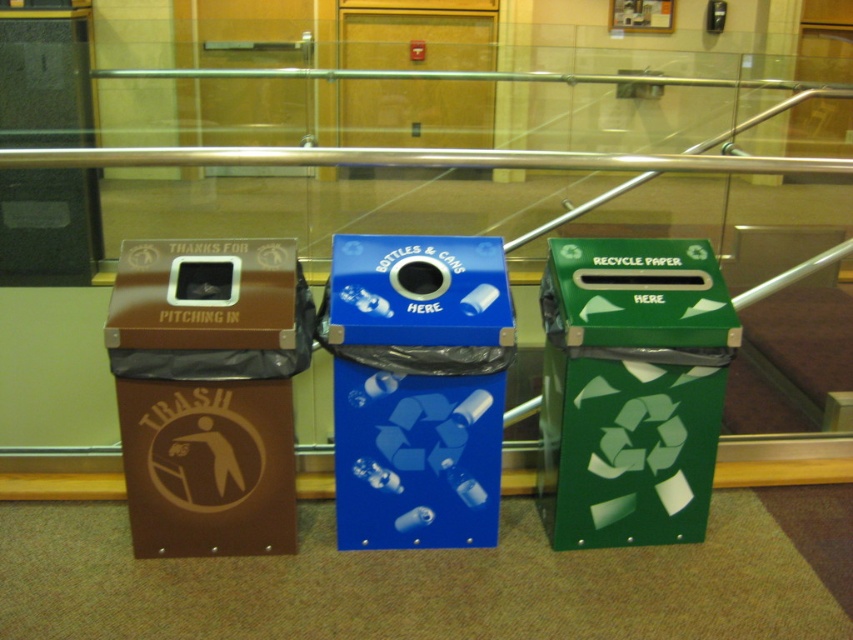
You are standing in front of the three recycling bins and need to place a recyclable item into the correct bin. The green glossy recycle bin at right is for bottles and cans, while the blue glossy plastic recycling bin at center is for paper products. Which bin should you aim for if you want to throw away a plastic bottle?

You should aim for the green glossy recycle bin at right because it is designated for bottles and cans, including plastic bottles. The blue glossy plastic recycling bin at center is for paper products.

You are standing in a hallway and see the brown matte trash can at left and the blue glossy plastic recycling bin at center. Which bin is positioned lower in relation to the other?

The brown matte trash can at left is positioned below the blue glossy plastic recycling bin at center, so it is lower.

You are standing at the point marked by the coordinate point at (608, 490). You need to reach both the brown bin and the blue bin. Which bin is closer to your current position?

The brown bin is closer to the point at (608, 490) because they are 7.07 feet apart, but the exact distance to each bin isn